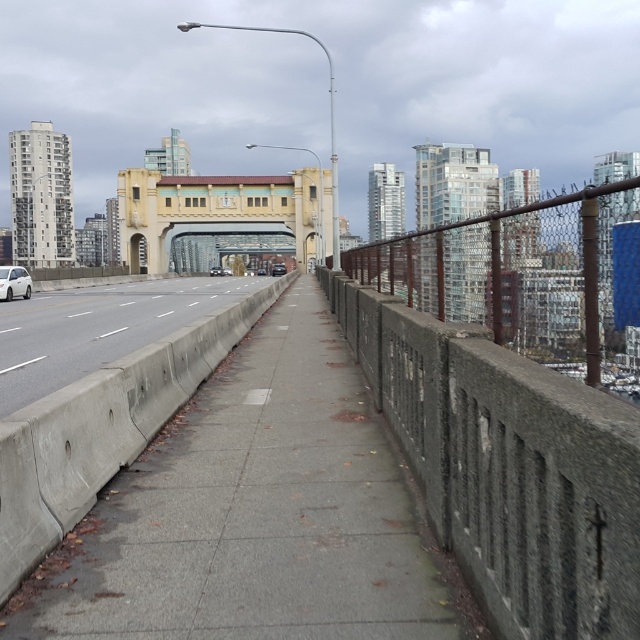
Is yellow matte bridge at center behind white matte car at left?

Yes, yellow matte bridge at center is further from the viewer.

Does yellow matte bridge at center appear under white matte car at left?

No, yellow matte bridge at center is not below white matte car at left.

Is point (193, 221) less distant than point (20, 291)?

No.

Find the location of a particular element. This screenshot has width=640, height=640. yellow matte bridge at center is located at coordinates (220, 214).

Which is below, gray concrete sidewalk at center or yellow matte bridge at center?

gray concrete sidewalk at center is lower down.

Where is `gray concrete sidewalk at center`? Image resolution: width=640 pixels, height=640 pixels. gray concrete sidewalk at center is located at coordinates (257, 515).

Between point (125, 566) and point (250, 202), which one is positioned behind?

The point (250, 202) is behind.

Identify the location of gray concrete sidewalk at center. The height and width of the screenshot is (640, 640). (257, 515).

Does gray concrete sidewalk at center have a lesser height compared to shiny silver sedan at center?

Yes.

Between gray concrete sidewalk at center and shiny silver sedan at center, which one appears on the right side from the viewer's perspective?

gray concrete sidewalk at center

Measure the distance between point (x=449, y=579) and camera.

The distance of point (x=449, y=579) from camera is 4.36 meters.

The height and width of the screenshot is (640, 640). I want to click on gray concrete sidewalk at center, so click(257, 515).